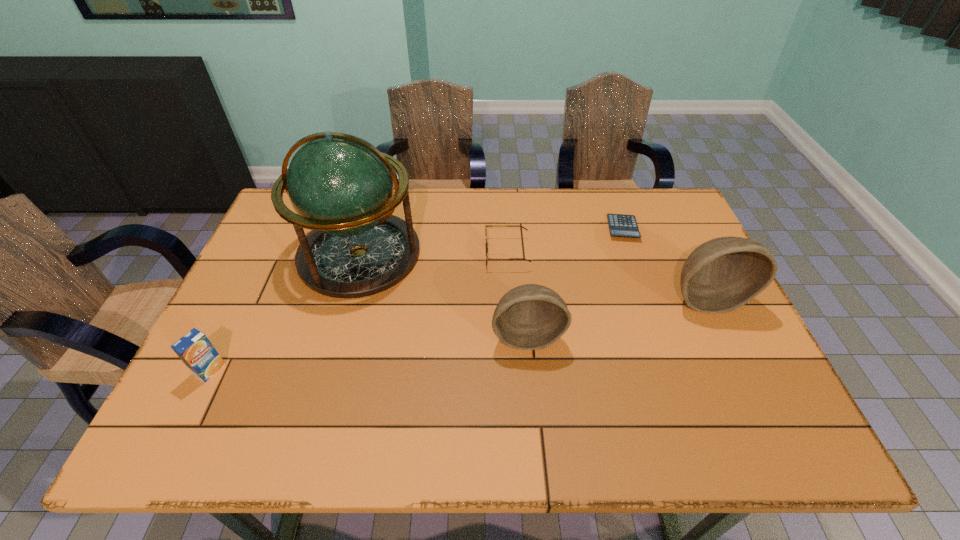
At what (x,y) coordinates should I click in order to perform the action: click on free spot at the left edge of the desktop. Please return your answer as a coordinate pair (x, y). The width and height of the screenshot is (960, 540). Looking at the image, I should click on (294, 249).

The width and height of the screenshot is (960, 540). In the image, there is a desktop. Identify the location of vacant space at the near left corner. (250, 402).

Locate an element on the screen. vacant space at the near right corner of the desktop is located at coordinates (737, 378).

Where is `free space between the second object from left to right and the third tallest object`? This screenshot has height=540, width=960. free space between the second object from left to right and the third tallest object is located at coordinates (444, 295).

This screenshot has height=540, width=960. Identify the location of vacant point located between the calculator and the tallest object. (491, 241).

In order to click on vacant point located between the nearest object and the shortest object in this screenshot , I will do `click(417, 299)`.

This screenshot has width=960, height=540. I want to click on free space between the taller bowl and the shortest object, so click(664, 263).

This screenshot has width=960, height=540. What are the coordinates of `vacant point located between the spectacles and the shortest object` in the screenshot? It's located at (564, 241).

What are the coordinates of `vacant space in between the shortest object and the tallest object` in the screenshot? It's located at (491, 241).

You are a GUI agent. You are given a task and a screenshot of the screen. Output one action in this format:
    pyautogui.click(x=<x>, y=<y>)
    Task: Click on the free space between the spectacles and the tallest object
    
    Given the screenshot: What is the action you would take?
    pyautogui.click(x=433, y=254)